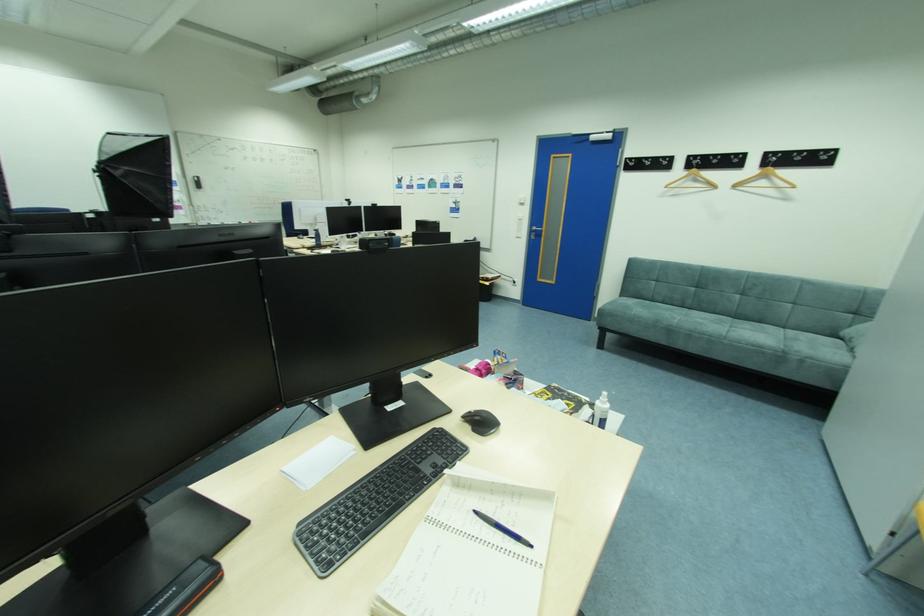
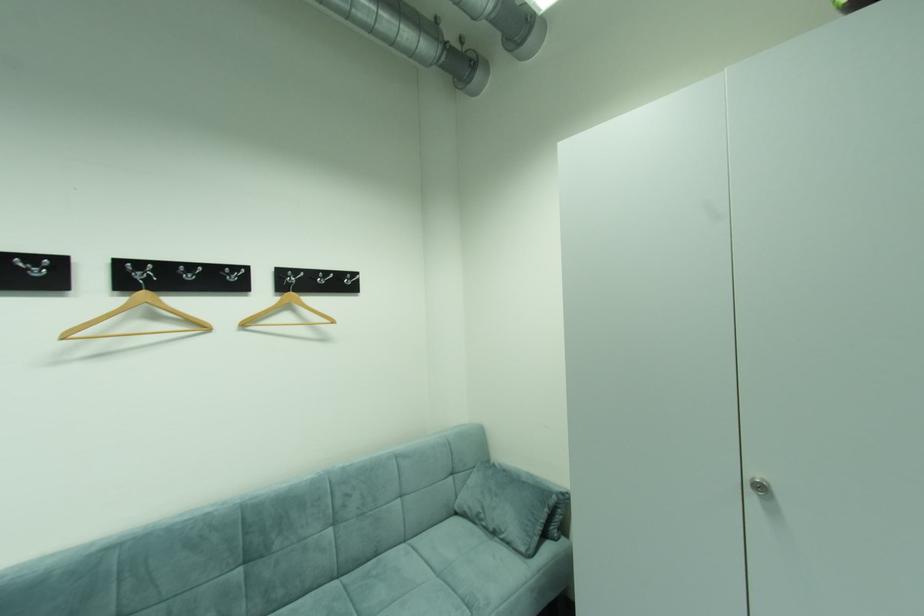
The point at (772,156) is marked in the first image. Where is the corresponding point in the second image?

(286, 274)